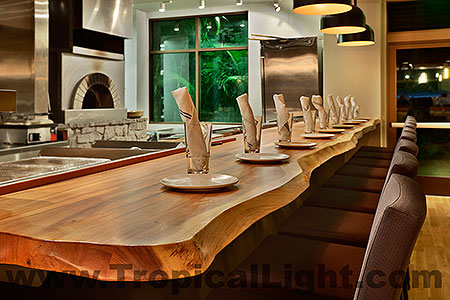
Image resolution: width=450 pixels, height=300 pixels. What are the coordinates of `window` in the screenshot? It's located at (214, 77).